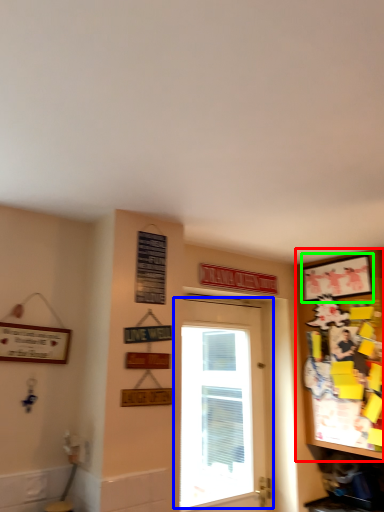
Question: Which object is the farthest from cabinetry (highlighted by a red box)? Choose among these: door (highlighted by a blue box) or picture frame (highlighted by a green box).

Choices:
 (A) door
 (B) picture frame

Answer: (A)